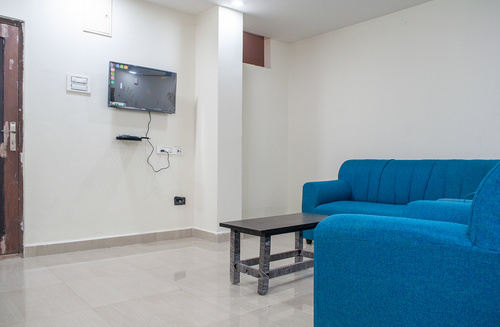
Where is `stickers`? This screenshot has width=500, height=327. stickers is located at coordinates (111, 77), (112, 64), (126, 65).